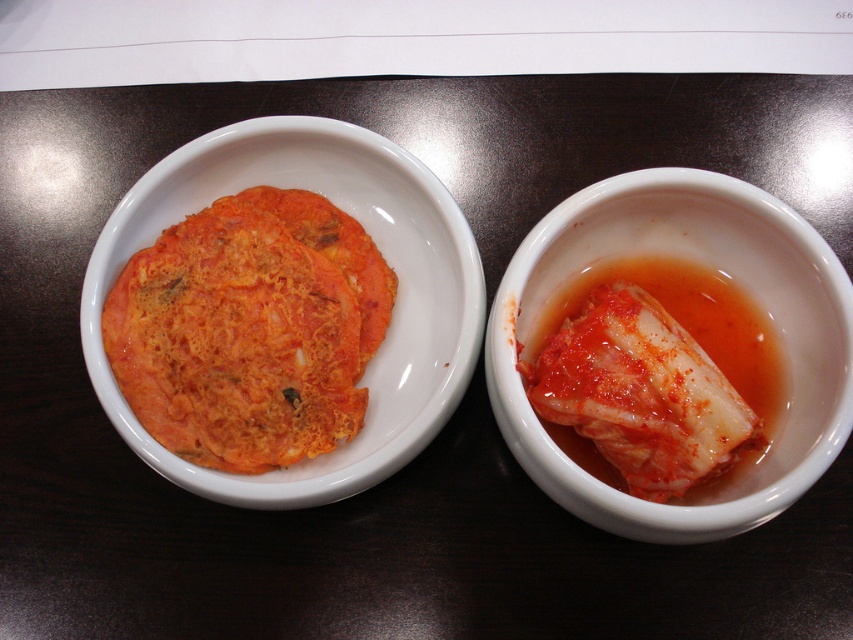
Question: Does orange matte kimchi at left have a lesser width compared to white glossy kimchi at right?

Choices:
 (A) yes
 (B) no

Answer: (B)

Question: Among these objects, which one is farthest from the camera?

Choices:
 (A) orange matte kimchi at left
 (B) white glossy kimchi at right

Answer: (A)

Question: Can you confirm if matte white bowl at center is wider than white glossy kimchi at right?

Choices:
 (A) no
 (B) yes

Answer: (B)

Question: Which object is positioned closest to the orange matte kimchi at left?

Choices:
 (A) white glossy kimchi at right
 (B) matte white bowl at center

Answer: (B)

Question: Which point is closer to the camera?

Choices:
 (A) (276, 284)
 (B) (500, 380)

Answer: (B)

Question: Is orange matte kimchi at left thinner than white glossy kimchi at right?

Choices:
 (A) yes
 (B) no

Answer: (B)